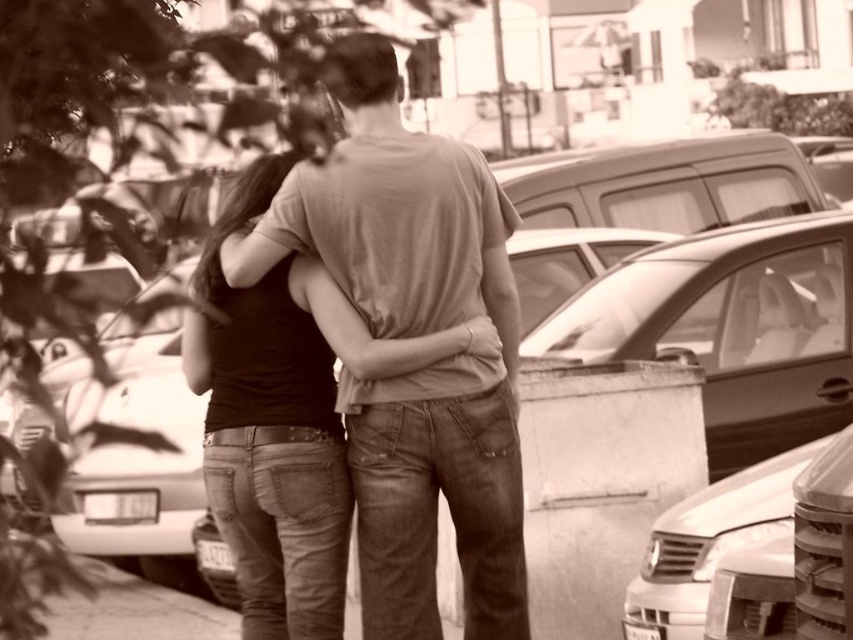
Question: Can you confirm if matte brown shirt at center is wider than black matte tank top at center?

Choices:
 (A) no
 (B) yes

Answer: (B)

Question: Is matte brown shirt at center to the right of metallic silver car at lower right from the viewer's perspective?

Choices:
 (A) no
 (B) yes

Answer: (A)

Question: Estimate the real-world distances between objects in this image. Which object is farther from the metallic silver car at lower right?

Choices:
 (A) matte brown shirt at center
 (B) black matte tank top at center

Answer: (B)

Question: Is matte brown shirt at center thinner than metallic silver car at lower right?

Choices:
 (A) no
 (B) yes

Answer: (A)

Question: Which point is closer to the camera taking this photo?

Choices:
 (A) (379, 61)
 (B) (305, 602)
 (C) (666, 605)

Answer: (A)

Question: Estimate the real-world distances between objects in this image. Which object is closer to the matte brown shirt at center?

Choices:
 (A) black matte tank top at center
 (B) metallic silver car at lower right

Answer: (A)